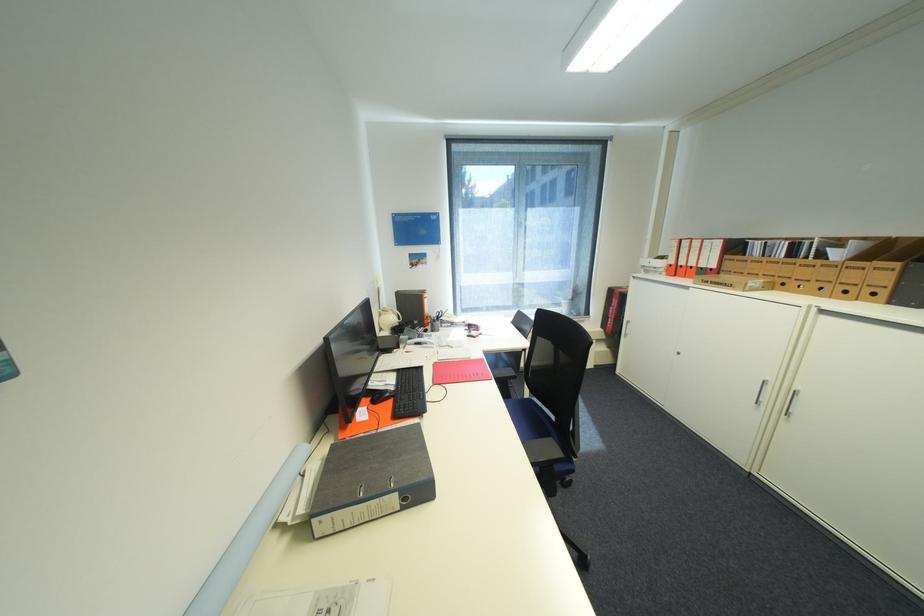
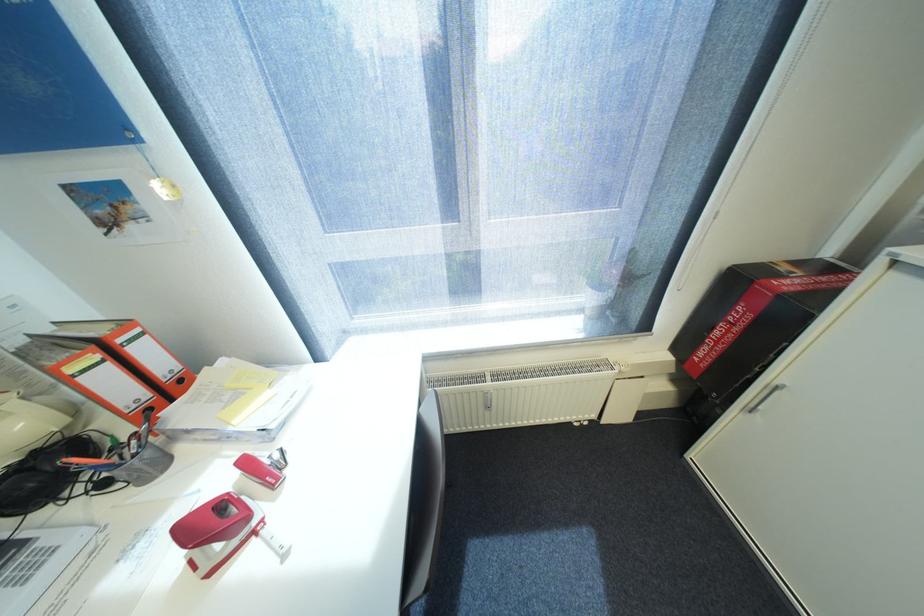
In a continuous first-person perspective shot, in which direction is the camera moving?

The cameraman walked toward right, forward.